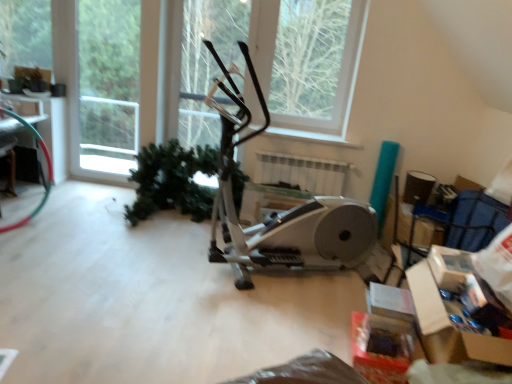
Locate an element on the screen. Image resolution: width=512 pixels, height=384 pixels. blank space to the left of green matte plant at center is located at coordinates (82, 205).